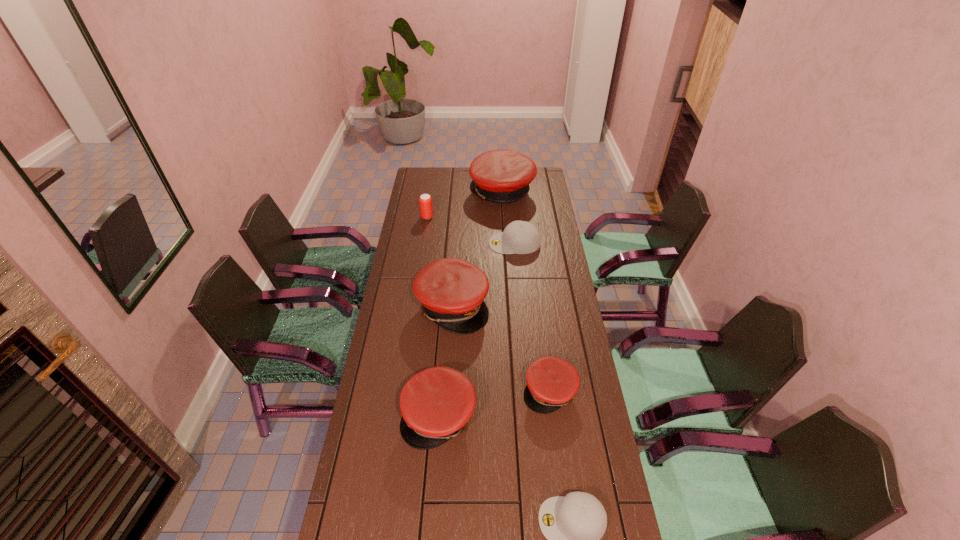
The height and width of the screenshot is (540, 960). I want to click on vacant space located at the front of the tallest cap where the visor is located, so click(414, 192).

Identify the location of vacant space positioned 0.090m at the front of the tallest cap where the visor is located. (453, 192).

Identify the location of vacant space located 0.160m at the front of the tallest cap where the visor is located. The width and height of the screenshot is (960, 540). (440, 192).

The image size is (960, 540). Identify the location of vacant space located 0.300m at the front of the third farthest cap where the visor is located. (564, 306).

Find the location of a particular element. free point located on the right of the red beer can is located at coordinates click(x=457, y=217).

This screenshot has height=540, width=960. I want to click on vacant position located at the front of the third biggest red cap where the visor is located, so click(x=434, y=481).

At what (x,y) coordinates should I click in order to perform the action: click on free space located on the front-facing side of the second farthest cap. Please return your answer as a coordinate pair (x, y). This screenshot has width=960, height=540. Looking at the image, I should click on (419, 243).

I want to click on vacant space located 0.100m on the front-facing side of the second farthest cap, so click(468, 243).

The width and height of the screenshot is (960, 540). I want to click on free region located on the front-facing side of the second farthest cap, so click(x=403, y=243).

Image resolution: width=960 pixels, height=540 pixels. I want to click on vacant space located 0.180m at the front of the smallest red cap where the visor is located, so click(x=561, y=470).